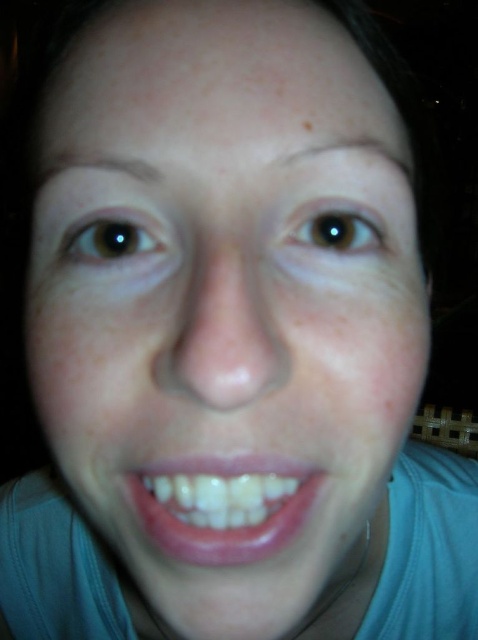
Which of these two, brown matte eye at upper center or brown matte freckle at upper center, stands shorter?

With less height is brown matte freckle at upper center.

Which is below, brown matte eye at upper center or brown matte freckle at upper center?

brown matte eye at upper center is below.

Describe the element at coordinates (336, 227) in the screenshot. I see `brown matte eye at upper center` at that location.

Where is `brown matte eye at upper center`? brown matte eye at upper center is located at coordinates (336, 227).

Who is positioned more to the left, glossy pink lips at center or brown matte freckle at upper center?

Positioned to the left is glossy pink lips at center.

Is point (192, 474) less distant than point (304, 125)?

Yes, it is.

At what (x,y) coordinates should I click in order to perform the action: click on glossy pink lips at center. Please return your answer as a coordinate pair (x, y). The image size is (478, 640). Looking at the image, I should click on (223, 506).

Which is in front, point (239, 486) or point (361, 228)?

Point (239, 486) is more forward.

Is point (248, 548) behind point (375, 230)?

No, (248, 548) is closer to viewer.

Find the location of a particular element. glossy pink lips at center is located at coordinates (223, 506).